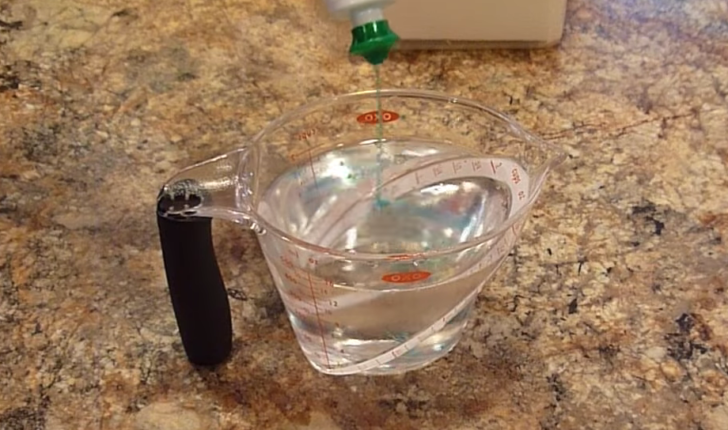
Where is `measuring cup`? The height and width of the screenshot is (430, 728). measuring cup is located at coordinates (376, 313).